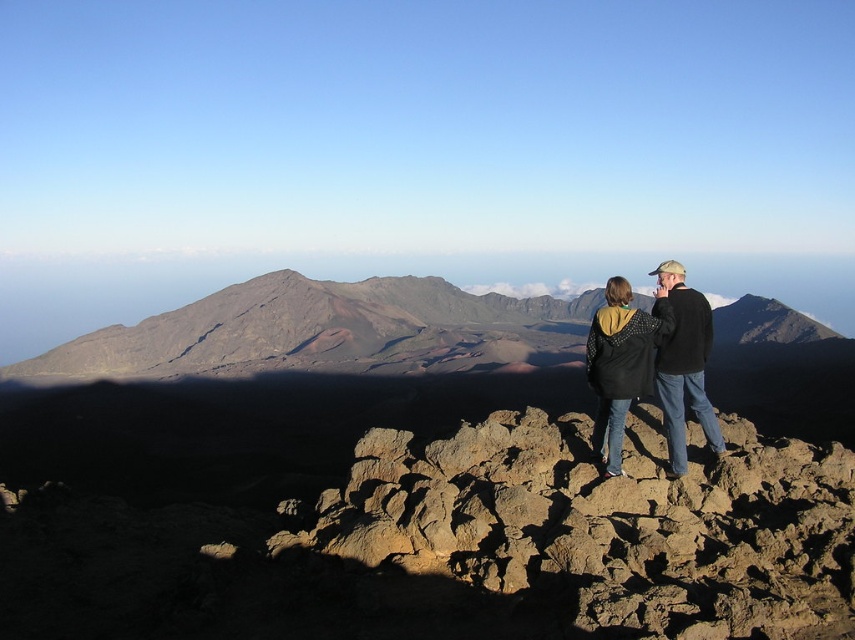
You are a hiker planning to cross the area between the brown rough rocks at center and the black jacket at center. Considering the width of the path, can you safely pass through without stepping on either object?

The brown rough rocks at center are wider than the black jacket at center. Since the path between them is narrower than the rocks, you might need to adjust your route to avoid stepping on the rocks or the jacket.

You are a hiker standing at the point marked as point (311, 326). Based on the scene, what type of terrain are you currently on?

The point (311, 326) is on rustic brown mountain at center, so you are on rugged mountainous terrain.

You are planning a hiking route and need to decide whether to traverse the brown rough rocks at center or the rustic brown mountain at center first. Based on their sizes, which path would be more feasible for a beginner hiker?

The brown rough rocks at center is smaller than the rustic brown mountain at center, so the path over the brown rough rocks at center would be more feasible for a beginner hiker since it requires less elevation gain and is easier to navigate.